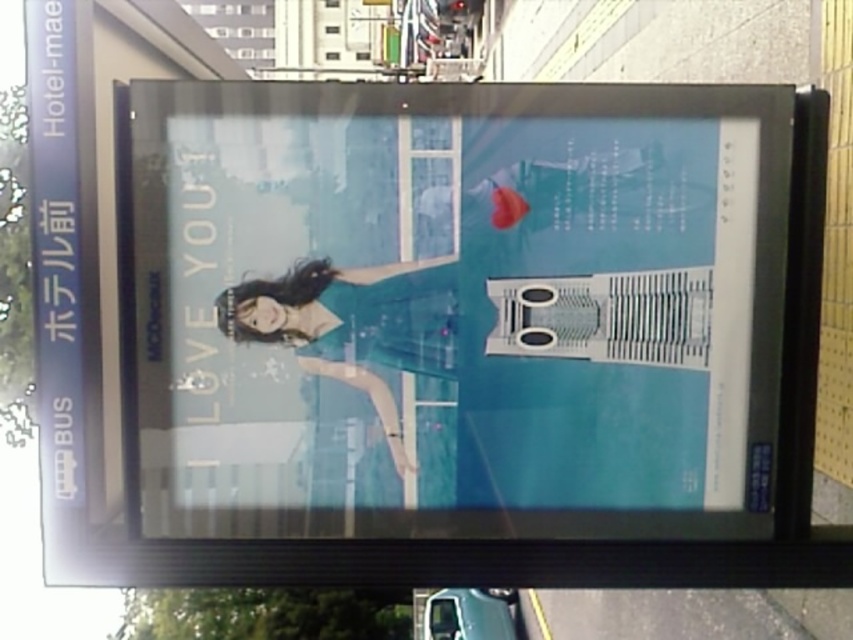
You are a passerby looking at the advertisement. Which object is on the left side between the matte blue poster at center and the matte teal dress at center?

The matte teal dress at center is on the left side because the matte blue poster at center is positioned on the right side of it.